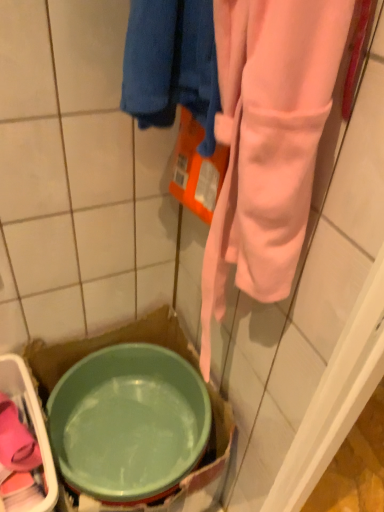
In order to face green matte bowl at lower left, should I rotate leftwards or rightwards?

Turn left approximately 7.912 degrees to face it.

Describe the element at coordinates (128, 422) in the screenshot. I see `green matte bowl at lower left` at that location.

Identify the location of green matte bowl at lower left. The height and width of the screenshot is (512, 384). (128, 422).

In order to click on green matte bowl at lower left in this screenshot , I will do `click(128, 422)`.